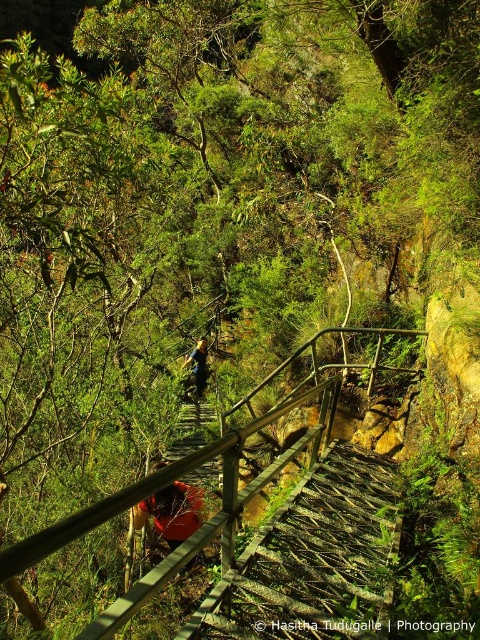
Consider the image. You are a hiker carrying a backpack weighing 15 kilograms. You are standing at the top of the wooden staircase at center. The staircase is designed to support a maximum weight of 20 kilograms per step. How many steps can you safely descend at once without exceeding the weight limit?

The wooden staircase at center can support 20 kilograms per step. Since your backpack weighs 15 kilograms, you can safely descend all steps at once as the weight is within the limit.

Based on the photo, you are a hiker carrying a red fabric backpack at center and standing on a wooden staircase at center. Can you safely step onto the next step below without the backpack hitting the staircase?

The wooden staircase at center is shorter than the red fabric backpack at center, so the backpack may hit the staircase when stepping down. It might not be safe to proceed without adjusting the backpack first.

You are a hiker carrying the green fabric backpack at center and want to descend the wooden staircase at center. Based on the scene, can you determine if the backpack will block your view of the staircase while you walk down?

The wooden staircase at center is in front of green fabric backpack at center, so the backpack will not block your view of the staircase as you walk down.